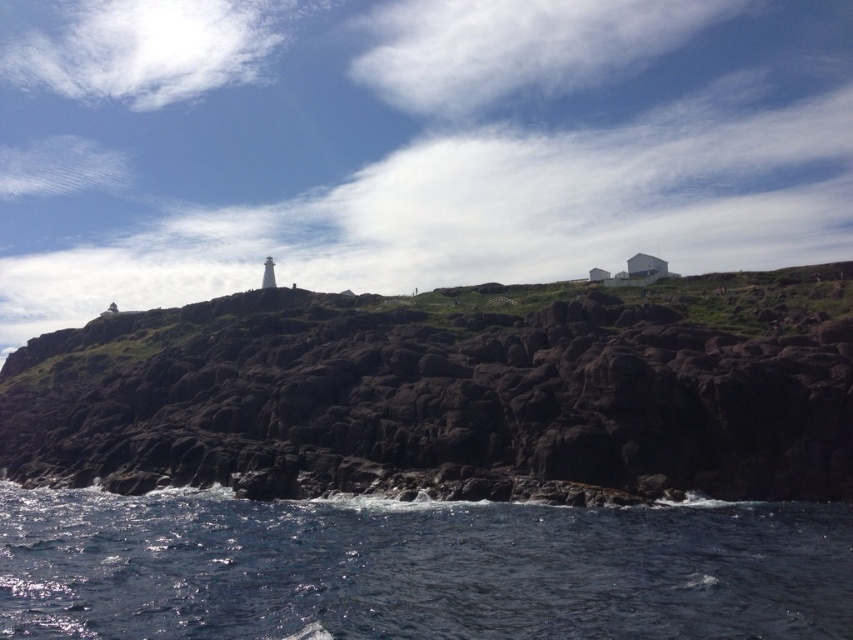
Is dark brown rocky cliff at center positioned in front of dark blue water at lower left?

No, it is behind dark blue water at lower left.

What do you see at coordinates (433, 401) in the screenshot? The width and height of the screenshot is (853, 640). I see `dark brown rocky cliff at center` at bounding box center [433, 401].

Which is behind, point (766, 465) or point (305, 570)?

Positioned behind is point (766, 465).

This screenshot has width=853, height=640. Identify the location of dark brown rocky cliff at center. (433, 401).